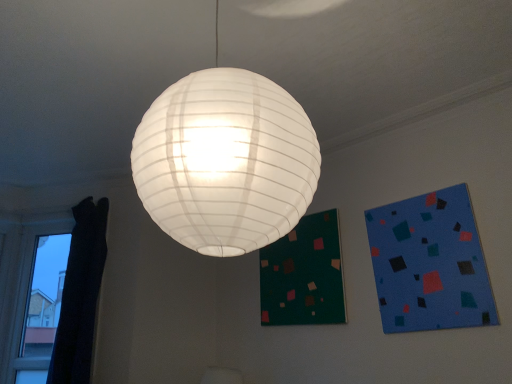
Where is `black curtain at left`? black curtain at left is located at coordinates [31, 296].

Where is `black fabric curtain at left`? black fabric curtain at left is located at coordinates (80, 295).

Considering the relative positions of black curtain at left and black fabric curtain at left in the image provided, is black curtain at left to the left of black fabric curtain at left from the viewer's perspective?

Indeed, black curtain at left is positioned on the left side of black fabric curtain at left.

From a real-world perspective, which is physically below, black curtain at left or black fabric curtain at left?

In real-world perspective, black curtain at left is lower.

From the picture: Is black curtain at left positioned beyond the bounds of black fabric curtain at left?

black curtain at left is positioned outside black fabric curtain at left.

Can you confirm if black curtain at left is wider than black fabric curtain at left?

Incorrect, the width of black curtain at left does not surpass that of black fabric curtain at left.

Are black curtain at left and blue matte square at upper right beside each other?

black curtain at left and blue matte square at upper right are not in contact.

Considering the sizes of objects black curtain at left and blue matte square at upper right in the image provided, who is bigger, black curtain at left or blue matte square at upper right?

black curtain at left.

Does black curtain at left turn towards blue matte square at upper right?

No.

Between point (74, 223) and point (384, 207), which one is positioned in front?

The point (384, 207) is in front.

Identify the location of window below the dark green fabric bulletin board at lower center (from a real-world perspective). (31, 296).

Considering the sizes of objects dark green fabric bulletin board at lower center and black curtain at left in the image provided, who is bigger, dark green fabric bulletin board at lower center or black curtain at left?

With larger size is black curtain at left.

Is dark green fabric bulletin board at lower center located outside black curtain at left?

That's correct, dark green fabric bulletin board at lower center is outside of black curtain at left.

Is dark green fabric bulletin board at lower center facing towards black curtain at left?

No, dark green fabric bulletin board at lower center does not turn towards black curtain at left.

Identify the location of bulletin board above the black fabric curtain at left (from the image's perspective). This screenshot has width=512, height=384. (304, 275).

Is black fabric curtain at left wider or thinner than dark green fabric bulletin board at lower center?

Clearly, black fabric curtain at left has more width compared to dark green fabric bulletin board at lower center.

Considering the relative positions of black fabric curtain at left and dark green fabric bulletin board at lower center in the image provided, is black fabric curtain at left to the left of dark green fabric bulletin board at lower center from the viewer's perspective?

→ Indeed, black fabric curtain at left is positioned on the left side of dark green fabric bulletin board at lower center.

What's the angular difference between black fabric curtain at left and dark green fabric bulletin board at lower center's facing directions?

33.3 degrees separate the facing orientations of black fabric curtain at left and dark green fabric bulletin board at lower center.

From a real-world perspective, relative to black fabric curtain at left, is dark green fabric bulletin board at lower center vertically above or below?

Clearly, from a real-world perspective, dark green fabric bulletin board at lower center is above black fabric curtain at left.

Between dark green fabric bulletin board at lower center and black fabric curtain at left, which one has larger size?

black fabric curtain at left.

Is the surface of dark green fabric bulletin board at lower center in direct contact with black fabric curtain at left?

dark green fabric bulletin board at lower center and black fabric curtain at left are clearly separated.

Is dark green fabric bulletin board at lower center aimed at black fabric curtain at left?

No, dark green fabric bulletin board at lower center is not facing towards black fabric curtain at left.

Is black fabric curtain at left oriented away from blue matte square at upper right?

No, blue matte square at upper right is not at the back of black fabric curtain at left.

From a real-world perspective, which is physically below, black fabric curtain at left or blue matte square at upper right?

From a 3D spatial view, blue matte square at upper right is below.

Considering the sizes of objects black fabric curtain at left and blue matte square at upper right in the image provided, who is wider, black fabric curtain at left or blue matte square at upper right?

With larger width is black fabric curtain at left.

Which object is further away from the camera taking this photo, black fabric curtain at left or blue matte square at upper right?

black fabric curtain at left.

From the image's perspective, is blue matte square at upper right over black fabric curtain at left?

Correct, blue matte square at upper right appears higher than black fabric curtain at left in the image.

Is black fabric curtain at left inside blue matte square at upper right?

No, blue matte square at upper right does not contain black fabric curtain at left.

Is blue matte square at upper right thinner than black fabric curtain at left?

Yes, blue matte square at upper right is thinner than black fabric curtain at left.

Is point (399, 309) behind point (78, 249)?

No, it is not.

At what (x,y) coordinates should I click in order to perform the action: click on curtain above the black curtain at left (from a real-world perspective). Please return your answer as a coordinate pair (x, y). Image resolution: width=512 pixels, height=384 pixels. Looking at the image, I should click on (80, 295).

Where is `design in front of the black curtain at left`? The width and height of the screenshot is (512, 384). design in front of the black curtain at left is located at coordinates (430, 263).

Looking at the image, which one is located closer to black fabric curtain at left, black curtain at left or dark green fabric bulletin board at lower center?

black curtain at left lies closer to black fabric curtain at left than the other object.

From the picture: Considering their positions, is blue matte square at upper right positioned closer to black fabric curtain at left than dark green fabric bulletin board at lower center?

Based on the image, dark green fabric bulletin board at lower center appears to be nearer to black fabric curtain at left.

Which object lies nearer to the anchor point dark green fabric bulletin board at lower center, blue matte square at upper right or black fabric curtain at left?

blue matte square at upper right is positioned closer to the anchor dark green fabric bulletin board at lower center.

Considering their positions, is blue matte square at upper right positioned closer to black fabric curtain at left than black curtain at left?

black curtain at left is positioned closer to the anchor black fabric curtain at left.

In the scene shown: Which object lies nearer to the anchor point black curtain at left, blue matte square at upper right or black fabric curtain at left?

black fabric curtain at left is positioned closer to the anchor black curtain at left.

Considering their positions, is black fabric curtain at left positioned closer to black curtain at left than blue matte square at upper right?

black fabric curtain at left lies closer to black curtain at left than the other object.

Which object lies nearer to the anchor point black fabric curtain at left, dark green fabric bulletin board at lower center or black curtain at left?

black curtain at left lies closer to black fabric curtain at left than the other object.

Based on their spatial positions, is black curtain at left or dark green fabric bulletin board at lower center further from blue matte square at upper right?

black curtain at left is positioned further to the anchor blue matte square at upper right.

Locate an element on the screen. The height and width of the screenshot is (384, 512). bulletin board situated between black curtain at left and blue matte square at upper right from left to right is located at coordinates (304, 275).

Image resolution: width=512 pixels, height=384 pixels. In order to click on bulletin board between black fabric curtain at left and blue matte square at upper right from left to right in this screenshot , I will do `click(304, 275)`.

What are the coordinates of `curtain situated between black curtain at left and blue matte square at upper right from left to right` in the screenshot? It's located at (80, 295).

Where is `curtain situated between black curtain at left and dark green fabric bulletin board at lower center from left to right`? The height and width of the screenshot is (384, 512). curtain situated between black curtain at left and dark green fabric bulletin board at lower center from left to right is located at coordinates (80, 295).